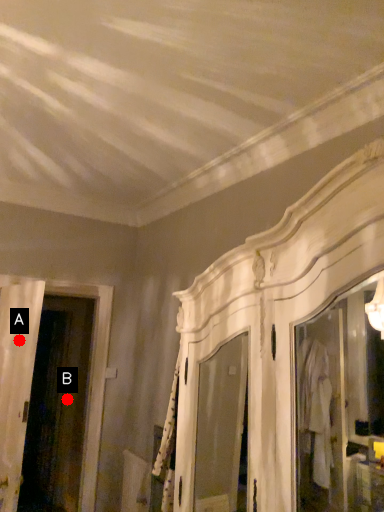
Question: Two points are circled on the image, labeled by A and B beside each circle. Which point is closer to the camera?

Choices:
 (A) A is closer
 (B) B is closer

Answer: (A)